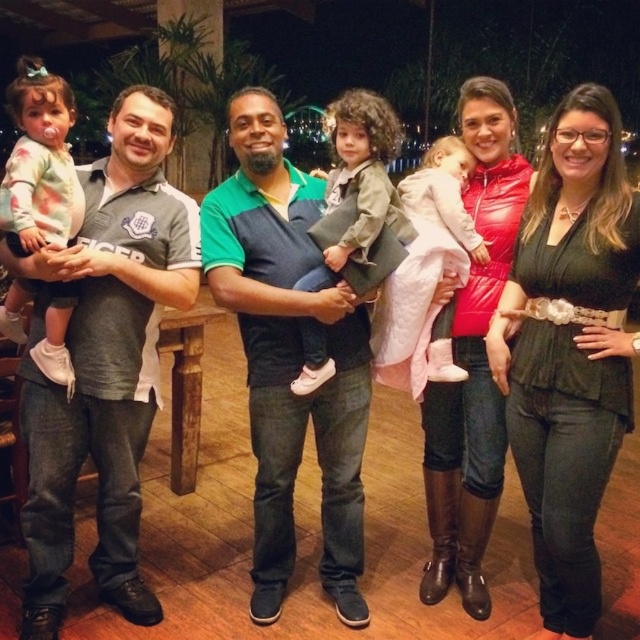
Question: Which of these objects is positioned closest to the gray cotton polo shirt at left?

Choices:
 (A) green fabric shirt at center
 (B) floral-patterned sweater at left

Answer: (B)

Question: Can you confirm if floral-patterned sweater at left is thinner than matte green jacket at center?

Choices:
 (A) yes
 (B) no

Answer: (A)

Question: Which object is closer to the camera taking this photo?

Choices:
 (A) matte red jacket at center
 (B) green fabric shirt at center
 (C) floral-patterned sweater at left
 (D) gray cotton polo shirt at left

Answer: (C)

Question: Does gray cotton polo shirt at left have a smaller size compared to quilted pink jacket at center?

Choices:
 (A) no
 (B) yes

Answer: (A)

Question: Is green textured blouse at center wider than quilted pink jacket at center?

Choices:
 (A) yes
 (B) no

Answer: (B)

Question: Which object is farther from the camera taking this photo?

Choices:
 (A) quilted pink jacket at center
 (B) matte green jacket at center
 (C) gray cotton polo shirt at left

Answer: (A)